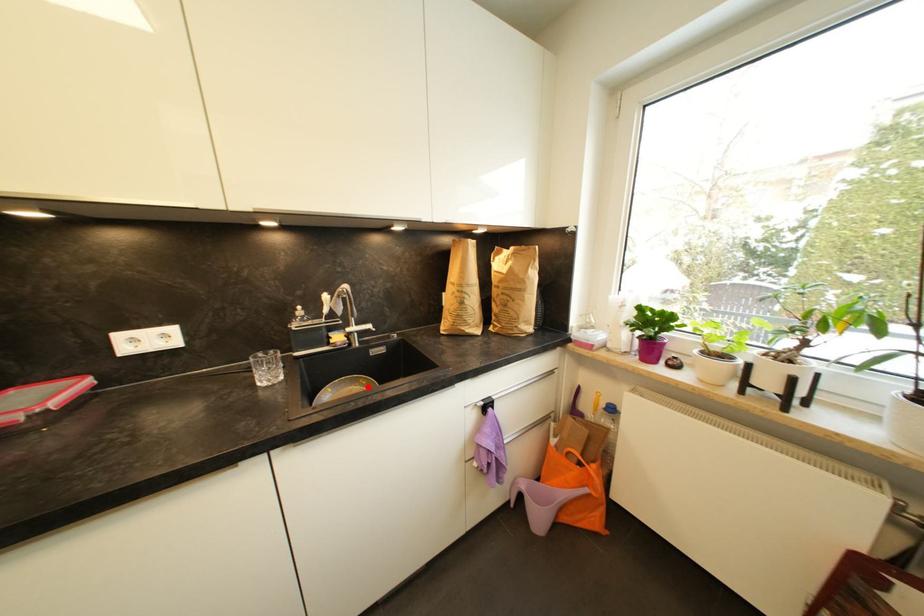
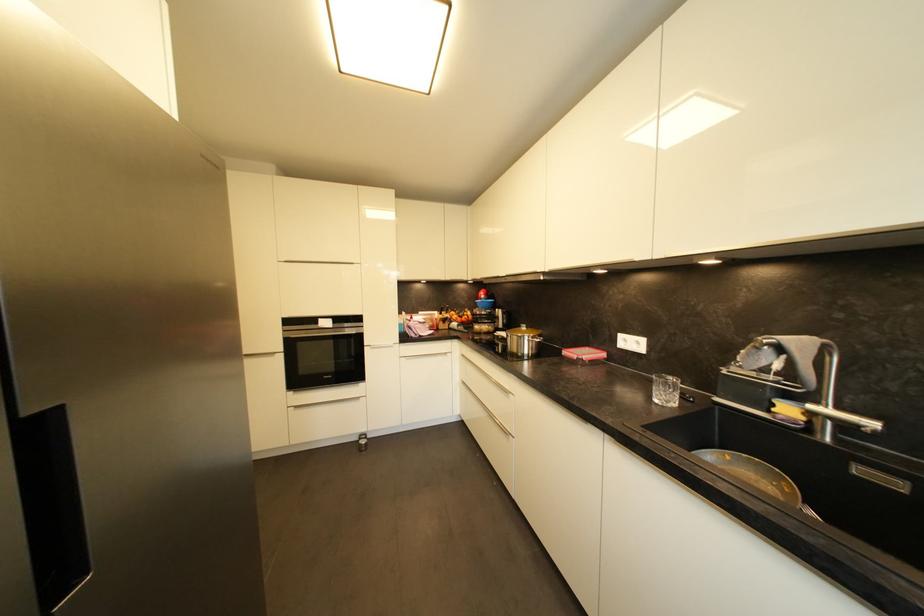
Find the pixel in the second image that matches the highlighted location in the first image.

(787, 493)